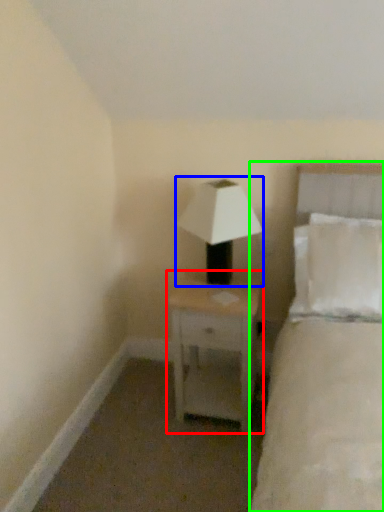
Question: Which is nearer to the nightstand (highlighted by a red box)? lamp (highlighted by a blue box) or bed (highlighted by a green box).

Choices:
 (A) lamp
 (B) bed

Answer: (A)